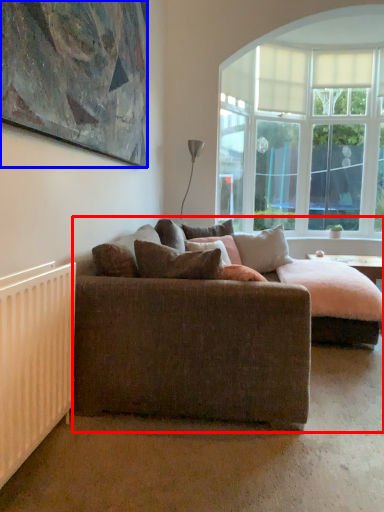
Question: Which of the following is the farthest to the observer, studio couch (highlighted by a red box) or picture frame (highlighted by a blue box)?

Choices:
 (A) studio couch
 (B) picture frame

Answer: (A)